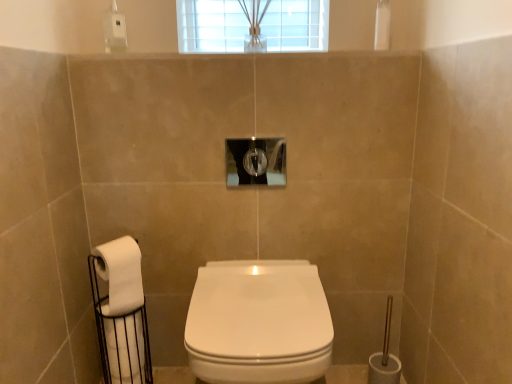
What do you see at coordinates (258, 323) in the screenshot? This screenshot has height=384, width=512. I see `white glossy toilet at center` at bounding box center [258, 323].

Describe the element at coordinates (121, 274) in the screenshot. Image resolution: width=512 pixels, height=384 pixels. I see `white matte toilet paper at lower left, acting as the first toilet paper starting from the top` at that location.

What do you see at coordinates (256, 161) in the screenshot? I see `clear glass hole at center` at bounding box center [256, 161].

Locate an element on the screen. The image size is (512, 384). white matte toilet paper at left, the 1th toilet paper when ordered from bottom to top is located at coordinates (121, 312).

Where is `toilet paper located in front of the white matte toilet paper at left, the 2th toilet paper in the top-to-bottom sequence`? toilet paper located in front of the white matte toilet paper at left, the 2th toilet paper in the top-to-bottom sequence is located at coordinates (121, 274).

Is white matte toilet paper at left, the 1th toilet paper when ordered from bottom to top, far from white matte toilet paper at lower left, placed as the 2th toilet paper when sorted from bottom to top?

That's not correct — white matte toilet paper at left, the 1th toilet paper when ordered from bottom to top, is a little close to white matte toilet paper at lower left, placed as the 2th toilet paper when sorted from bottom to top.

From a real-world perspective, between white matte toilet paper at left, the 1th toilet paper when ordered from bottom to top, and white matte toilet paper at lower left, acting as the first toilet paper starting from the top, who is vertically lower?

From a 3D spatial view, white matte toilet paper at left, the 1th toilet paper when ordered from bottom to top, is below.

In terms of width, does white matte toilet paper at left, the 2th toilet paper in the top-to-bottom sequence, look wider or thinner when compared to white matte toilet paper at lower left, placed as the 2th toilet paper when sorted from bottom to top?

Clearly, white matte toilet paper at left, the 2th toilet paper in the top-to-bottom sequence, has more width compared to white matte toilet paper at lower left, placed as the 2th toilet paper when sorted from bottom to top.

Could you tell me if clear glass hole at center is facing white glossy toilet at center?

No, clear glass hole at center is not aimed at white glossy toilet at center.

You are a GUI agent. You are given a task and a screenshot of the screen. Output one action in this format:
    pyautogui.click(x=<x>, y=<y>)
    Task: Click on the hole that is on the left side of white glossy toilet at center
    The image size is (512, 384).
    Given the screenshot: What is the action you would take?
    pyautogui.click(x=256, y=161)

In the scene shown: Is clear glass hole at center inside or outside of white glossy toilet at center?

clear glass hole at center exists outside the volume of white glossy toilet at center.

From a real-world perspective, is clear glass hole at center above or below white glossy toilet at center?

Clearly, from a real-world perspective, clear glass hole at center is above white glossy toilet at center.

From the picture: From a real-world perspective, is white matte toilet paper at left, the 1th toilet paper when ordered from bottom to top, positioned above or below white glossy toilet at center?

white matte toilet paper at left, the 1th toilet paper when ordered from bottom to top, is below white glossy toilet at center.

Locate an element on the screen. Image resolution: width=512 pixels, height=384 pixels. toilet on the right side of white matte toilet paper at left, the 2th toilet paper in the top-to-bottom sequence is located at coordinates 258,323.

Which of these two, white matte toilet paper at left, the 1th toilet paper when ordered from bottom to top, or white glossy toilet at center, is smaller?

white matte toilet paper at left, the 1th toilet paper when ordered from bottom to top.

From their relative heights in the image, would you say white matte toilet paper at left, the 2th toilet paper in the top-to-bottom sequence, is taller or shorter than white glossy toilet at center?

In the image, white matte toilet paper at left, the 2th toilet paper in the top-to-bottom sequence, appears to be taller than white glossy toilet at center.

Is white matte toilet paper at left, the 2th toilet paper in the top-to-bottom sequence, wider or thinner than clear glass hole at center?

In the image, white matte toilet paper at left, the 2th toilet paper in the top-to-bottom sequence, appears to be wider than clear glass hole at center.

Who is smaller, white matte toilet paper at left, the 1th toilet paper when ordered from bottom to top, or clear glass hole at center?

With smaller size is clear glass hole at center.

Is point (96, 249) positioned in front of point (275, 185)?

Yes, it is in front of point (275, 185).

Is the surface of white matte toilet paper at left, the 1th toilet paper when ordered from bottom to top, in direct contact with clear glass hole at center?

No, white matte toilet paper at left, the 1th toilet paper when ordered from bottom to top, is not with clear glass hole at center.

Measure the distance between white glossy toilet at center and white matte toilet paper at lower left, acting as the first toilet paper starting from the top.

white glossy toilet at center is 14.60 inches away from white matte toilet paper at lower left, acting as the first toilet paper starting from the top.

Between point (221, 358) and point (98, 269), which one is positioned behind?

The point (98, 269) is farther from the camera.

Considering the relative positions of white glossy toilet at center and white matte toilet paper at lower left, acting as the first toilet paper starting from the top, in the image provided, is white glossy toilet at center behind white matte toilet paper at lower left, acting as the first toilet paper starting from the top,?

No.

Can you confirm if white glossy toilet at center is taller than white matte toilet paper at lower left, placed as the 2th toilet paper when sorted from bottom to top?

Yes.

Consider the image. From the image's perspective, is white matte toilet paper at lower left, acting as the first toilet paper starting from the top, positioned above or below clear glass hole at center?

white matte toilet paper at lower left, acting as the first toilet paper starting from the top, is below clear glass hole at center.

In the scene shown: From a real-world perspective, between white matte toilet paper at lower left, placed as the 2th toilet paper when sorted from bottom to top, and clear glass hole at center, who is vertically lower?

white matte toilet paper at lower left, placed as the 2th toilet paper when sorted from bottom to top, is physically lower.

In order to click on hole behind the white matte toilet paper at lower left, acting as the first toilet paper starting from the top in this screenshot , I will do click(x=256, y=161).

Can you tell me how much white matte toilet paper at lower left, acting as the first toilet paper starting from the top, and clear glass hole at center differ in facing direction?

The facing directions of white matte toilet paper at lower left, acting as the first toilet paper starting from the top, and clear glass hole at center are 37.8 degrees apart.

From a real-world perspective, is white glossy toilet at center located beneath white matte toilet paper at left, the 2th toilet paper in the top-to-bottom sequence?

No, from a real-world perspective, white glossy toilet at center is not below white matte toilet paper at left, the 2th toilet paper in the top-to-bottom sequence.

Is white glossy toilet at center smaller than white matte toilet paper at left, the 2th toilet paper in the top-to-bottom sequence?

No.

Is white glossy toilet at center taller or shorter than white matte toilet paper at left, the 2th toilet paper in the top-to-bottom sequence?

white glossy toilet at center is shorter than white matte toilet paper at left, the 2th toilet paper in the top-to-bottom sequence.

From the picture: Which is closer to the camera, (x=223, y=382) or (x=130, y=253)?

The point (x=223, y=382) is closer to the camera.

Image resolution: width=512 pixels, height=384 pixels. Identify the location of toilet paper on the right of white matte toilet paper at left, the 1th toilet paper when ordered from bottom to top. (121, 274).

Find the location of a particular element. This screenshot has height=384, width=512. toilet below the clear glass hole at center (from the image's perspective) is located at coordinates (258, 323).

Consider the image. Which object lies further to the anchor point white glossy toilet at center, white matte toilet paper at left, the 2th toilet paper in the top-to-bottom sequence, or white matte toilet paper at lower left, placed as the 2th toilet paper when sorted from bottom to top?

white matte toilet paper at left, the 2th toilet paper in the top-to-bottom sequence, lies further to white glossy toilet at center than the other object.

In the scene shown: Based on their spatial positions, is white glossy toilet at center or white matte toilet paper at lower left, placed as the 2th toilet paper when sorted from bottom to top, closer to clear glass hole at center?

The object closer to clear glass hole at center is white glossy toilet at center.

Which object lies nearer to the anchor point clear glass hole at center, white matte toilet paper at lower left, placed as the 2th toilet paper when sorted from bottom to top, or white matte toilet paper at left, the 2th toilet paper in the top-to-bottom sequence?

white matte toilet paper at lower left, placed as the 2th toilet paper when sorted from bottom to top, is positioned closer to the anchor clear glass hole at center.

Looking at the image, which one is located closer to white matte toilet paper at lower left, acting as the first toilet paper starting from the top, white glossy toilet at center or clear glass hole at center?

The object closer to white matte toilet paper at lower left, acting as the first toilet paper starting from the top, is white glossy toilet at center.

Considering their positions, is white glossy toilet at center positioned closer to white matte toilet paper at left, the 2th toilet paper in the top-to-bottom sequence, than white matte toilet paper at lower left, acting as the first toilet paper starting from the top?

The object closer to white matte toilet paper at left, the 2th toilet paper in the top-to-bottom sequence, is white matte toilet paper at lower left, acting as the first toilet paper starting from the top.

Looking at the image, which one is located further to clear glass hole at center, white glossy toilet at center or white matte toilet paper at left, the 2th toilet paper in the top-to-bottom sequence?

white matte toilet paper at left, the 2th toilet paper in the top-to-bottom sequence, is positioned further to the anchor clear glass hole at center.

Estimate the real-world distances between objects in this image. Which object is further from white matte toilet paper at lower left, placed as the 2th toilet paper when sorted from bottom to top, clear glass hole at center or white matte toilet paper at left, the 2th toilet paper in the top-to-bottom sequence?

Among the two, clear glass hole at center is located further to white matte toilet paper at lower left, placed as the 2th toilet paper when sorted from bottom to top.

When comparing their distances from white glossy toilet at center, does clear glass hole at center or white matte toilet paper at lower left, placed as the 2th toilet paper when sorted from bottom to top, seem closer?

Based on the image, white matte toilet paper at lower left, placed as the 2th toilet paper when sorted from bottom to top, appears to be nearer to white glossy toilet at center.

Image resolution: width=512 pixels, height=384 pixels. I want to click on toilet paper between clear glass hole at center and white matte toilet paper at left, the 1th toilet paper when ordered from bottom to top, from top to bottom, so click(121, 274).

Find the location of a particular element. This screenshot has height=384, width=512. toilet paper between white matte toilet paper at left, the 2th toilet paper in the top-to-bottom sequence, and white glossy toilet at center is located at coordinates (121, 274).

In order to click on toilet that lies between clear glass hole at center and white matte toilet paper at left, the 2th toilet paper in the top-to-bottom sequence, from top to bottom in this screenshot , I will do `click(258, 323)`.

Image resolution: width=512 pixels, height=384 pixels. Find the location of `hole located between white matte toilet paper at lower left, placed as the 2th toilet paper when sorted from bottom to top, and white glossy toilet at center in the left-right direction`. hole located between white matte toilet paper at lower left, placed as the 2th toilet paper when sorted from bottom to top, and white glossy toilet at center in the left-right direction is located at coordinates (256, 161).